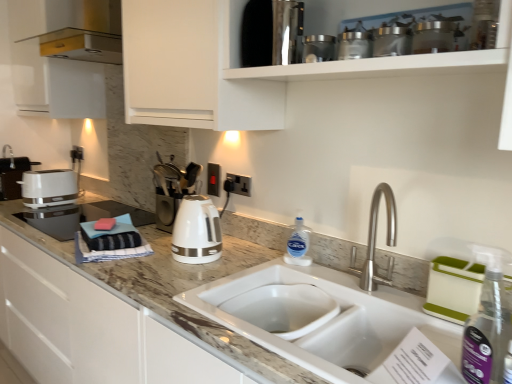
Find the location of a particular element. free space in front of white glossy electric kettle at center is located at coordinates (185, 278).